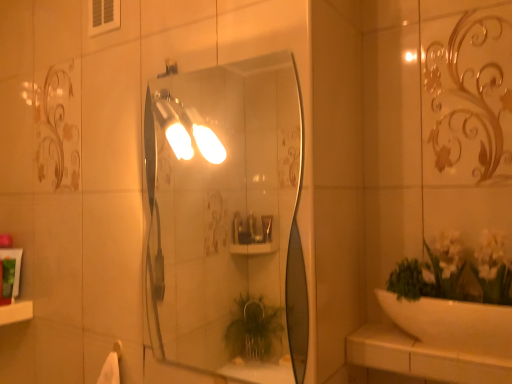
Question: Is green matte tube at left, the second toiletry positioned from the back, not within white ceramic counter top at lower right?

Choices:
 (A) no
 (B) yes

Answer: (B)

Question: Is green matte tube at left, the second toiletry positioned from the back, at the left side of white ceramic counter top at lower right?

Choices:
 (A) no
 (B) yes

Answer: (B)

Question: Is green matte tube at left, the second toiletry positioned from the back, to the right of white ceramic counter top at lower right from the viewer's perspective?

Choices:
 (A) yes
 (B) no

Answer: (B)

Question: Considering the relative sizes of green matte tube at left, the 1th toiletry in the front-to-back sequence, and white ceramic counter top at lower right in the image provided, is green matte tube at left, the 1th toiletry in the front-to-back sequence, wider than white ceramic counter top at lower right?

Choices:
 (A) yes
 (B) no

Answer: (B)

Question: Does green matte tube at left, the 1th toiletry in the front-to-back sequence, contain white ceramic counter top at lower right?

Choices:
 (A) yes
 (B) no

Answer: (B)

Question: Does green matte tube at left, the second toiletry positioned from the back, lie in front of white ceramic counter top at lower right?

Choices:
 (A) no
 (B) yes

Answer: (A)

Question: From a real-world perspective, is matte silver light fixture at upper center physically below white ceramic counter top at lower right?

Choices:
 (A) yes
 (B) no

Answer: (B)

Question: Can you confirm if matte silver light fixture at upper center is taller than white ceramic counter top at lower right?

Choices:
 (A) no
 (B) yes

Answer: (B)

Question: Is the depth of matte silver light fixture at upper center less than that of white ceramic counter top at lower right?

Choices:
 (A) no
 (B) yes

Answer: (A)

Question: Is matte silver light fixture at upper center facing towards white ceramic counter top at lower right?

Choices:
 (A) yes
 (B) no

Answer: (B)

Question: Is matte silver light fixture at upper center far from white ceramic counter top at lower right?

Choices:
 (A) no
 (B) yes

Answer: (A)

Question: Is matte silver light fixture at upper center located outside white ceramic counter top at lower right?

Choices:
 (A) yes
 (B) no

Answer: (A)

Question: Can you confirm if green matte tube at left, acting as the second toiletry starting from the front, is bigger than white glossy ledge at lower left?

Choices:
 (A) no
 (B) yes

Answer: (A)